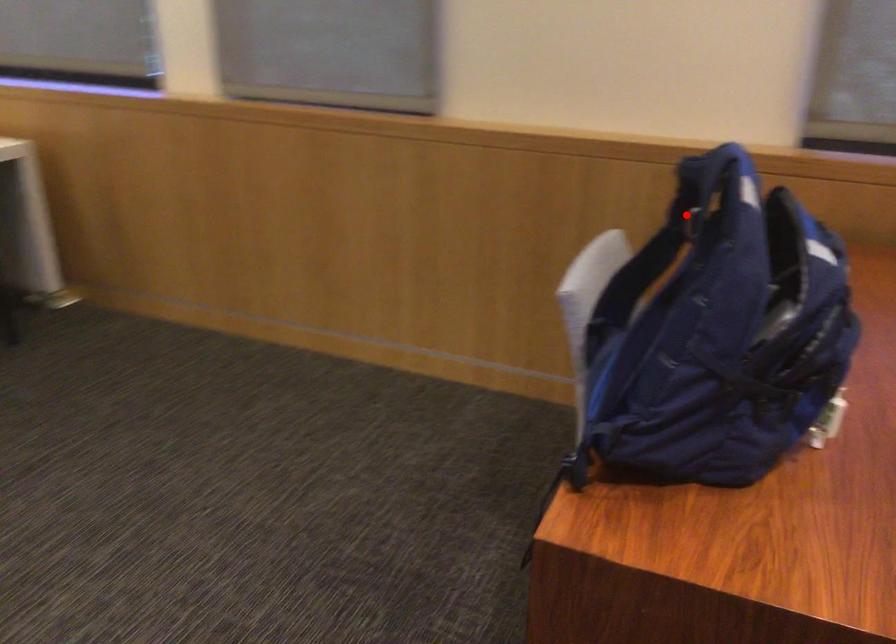
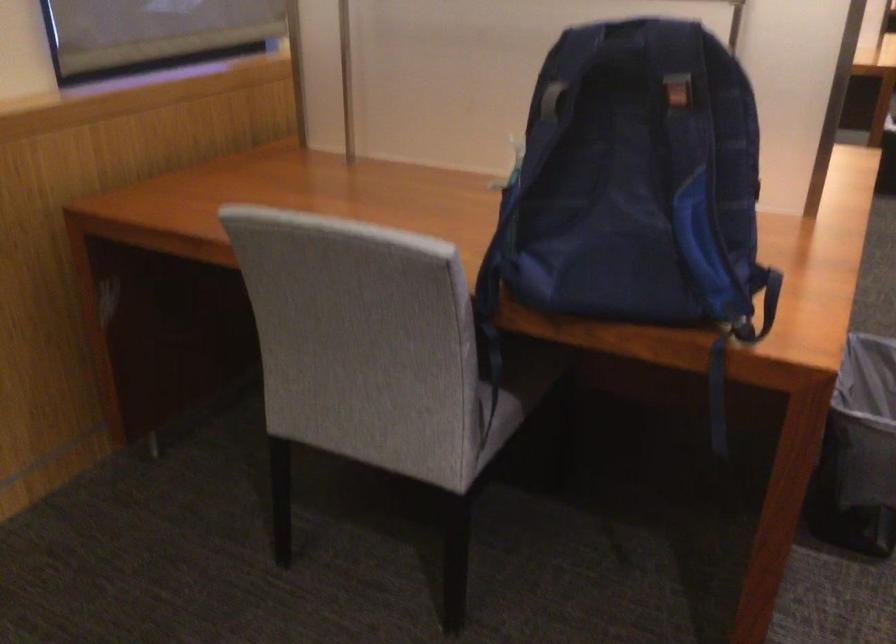
Question: I am providing you with two images of the same scene from different viewpoints. A red point is shown in image1. For the corresponding object point in image2, is it positioned nearer or farther from the camera?

Choices:
 (A) Nearer
 (B) Farther

Answer: (B)